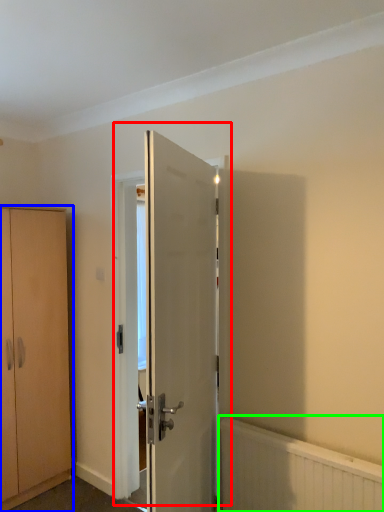
Question: Which object is positioned closest to door (highlighted by a red box)? Select from cabinetry (highlighted by a blue box) and radiator (highlighted by a green box).

Choices:
 (A) cabinetry
 (B) radiator

Answer: (B)